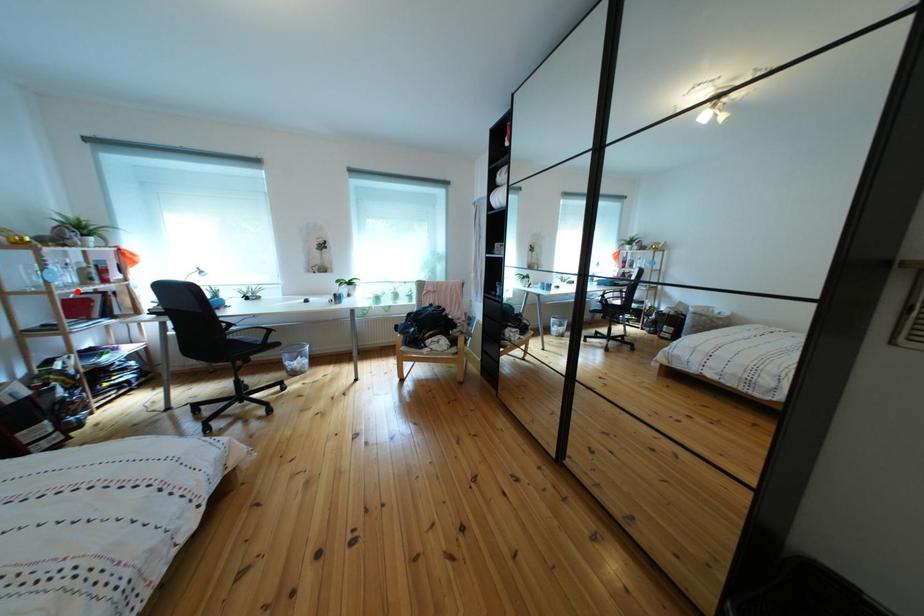
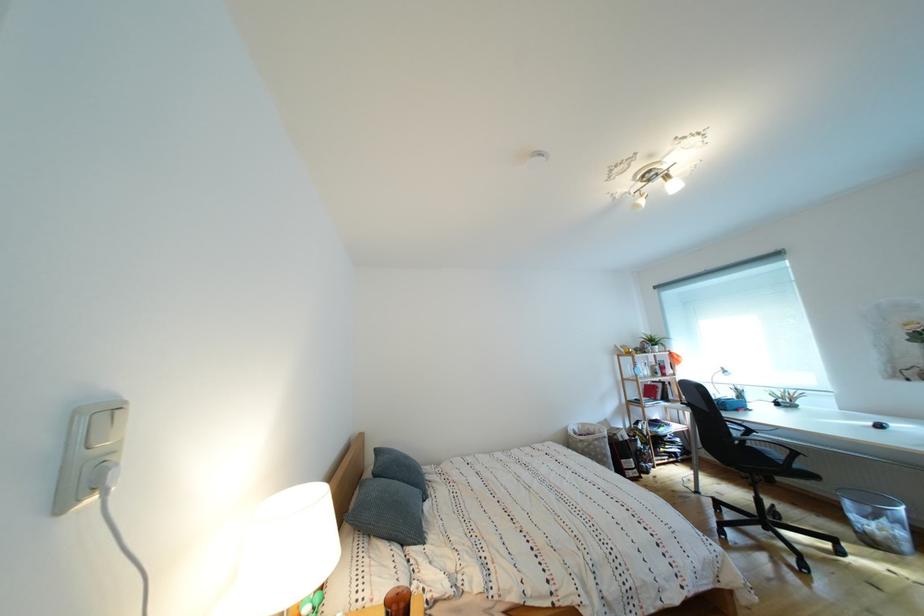
Locate, in the second image, the point that corresponds to the highlighted location in the first image.

(657, 383)